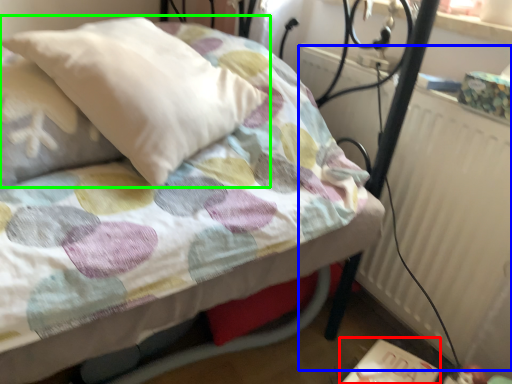
Question: Which is nearer to the table (highlighted by a red box)? radiator (highlighted by a blue box) or pillow (highlighted by a green box).

Choices:
 (A) radiator
 (B) pillow

Answer: (A)